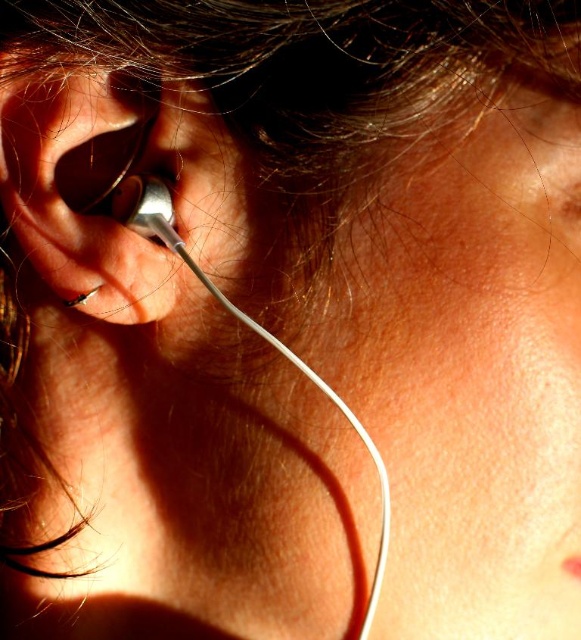
Is silver metallic earbud at left positioned in front of silver metallic earring at left?

Yes.

Is point (27, 141) positioned in front of point (156, 218)?

That is True.

Locate an element on the screen. silver metallic earbud at left is located at coordinates (80, 189).